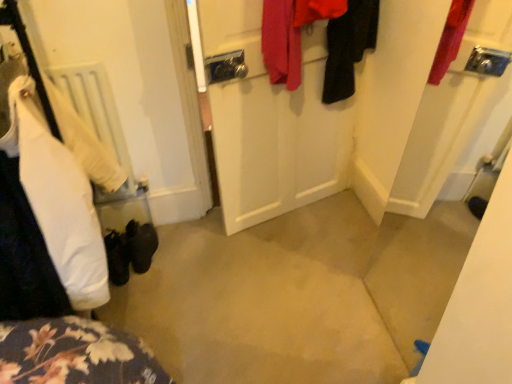
Question: From the image's perspective, does white matte door at center appear lower than red fabric coat at upper center, which ranks as the second clothing in right-to-left order?

Choices:
 (A) yes
 (B) no

Answer: (A)

Question: Is white matte door at center with red fabric coat at upper center, which ranks as the second clothing in right-to-left order?

Choices:
 (A) no
 (B) yes

Answer: (A)

Question: Is white matte door at center not near red fabric coat at upper center, which ranks as the second clothing in right-to-left order?

Choices:
 (A) yes
 (B) no

Answer: (B)

Question: From a real-world perspective, is white matte door at center located higher than red fabric coat at upper center, arranged as the 2th clothing when viewed from the left?

Choices:
 (A) yes
 (B) no

Answer: (B)

Question: Is white matte door at center oriented towards red fabric coat at upper center, which ranks as the second clothing in right-to-left order?

Choices:
 (A) no
 (B) yes

Answer: (B)

Question: Does white matte door at center have a smaller size compared to red fabric coat at upper center, which ranks as the second clothing in right-to-left order?

Choices:
 (A) no
 (B) yes

Answer: (A)

Question: Can you confirm if white matte radiator at left is positioned to the left of white matte door at center?

Choices:
 (A) no
 (B) yes

Answer: (B)

Question: Is white matte radiator at left facing towards white matte door at center?

Choices:
 (A) yes
 (B) no

Answer: (B)

Question: Is white matte radiator at left not near white matte door at center?

Choices:
 (A) yes
 (B) no

Answer: (B)

Question: Does white matte radiator at left have a greater height compared to white matte door at center?

Choices:
 (A) yes
 (B) no

Answer: (B)

Question: Considering the relative positions of white matte radiator at left and white matte door at center in the image provided, is white matte radiator at left in front of white matte door at center?

Choices:
 (A) no
 (B) yes

Answer: (A)

Question: Is white matte door at center located within white matte radiator at left?

Choices:
 (A) yes
 (B) no

Answer: (B)

Question: Is white matte door at center at the right side of black fabric coat at upper right, which ranks as the 1th clothing in right-to-left order?

Choices:
 (A) yes
 (B) no

Answer: (B)